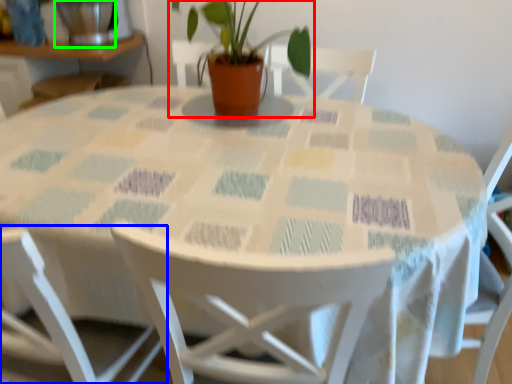
Question: Based on their relative distances, which object is farther from houseplant (highlighted by a red box)? Choose from chair (highlighted by a blue box) and glass vase (highlighted by a green box).

Choices:
 (A) chair
 (B) glass vase

Answer: (A)